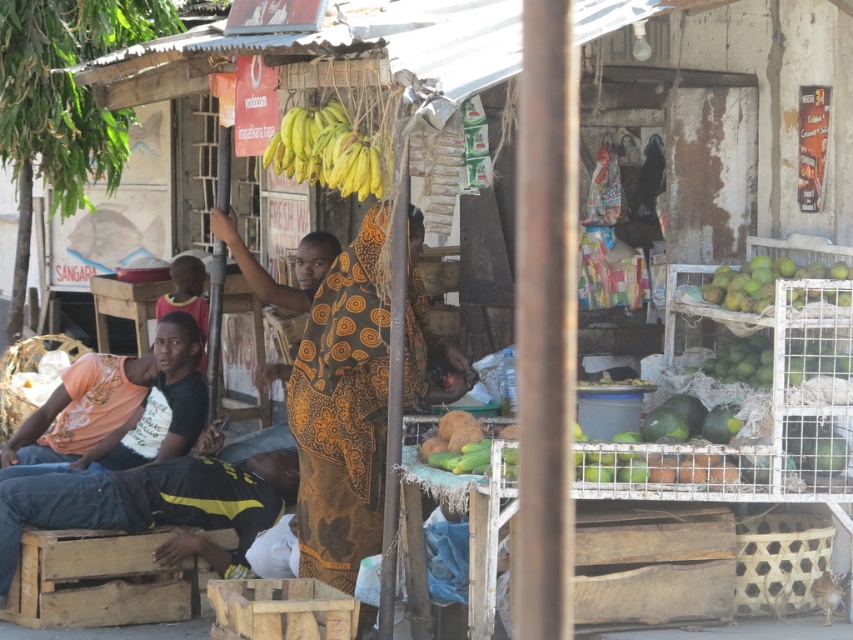
Does wooden crate at lower center have a greater height compared to green matte mangoes at right?

Indeed, wooden crate at lower center has a greater height compared to green matte mangoes at right.

Which is more to the right, wooden crate at lower center or green matte mangoes at right?

green matte mangoes at right is more to the right.

Who is more distant from viewer, (347, 596) or (755, 266)?

The point (755, 266) is behind.

The image size is (853, 640). Find the location of `wooden crate at lower center`. wooden crate at lower center is located at coordinates (280, 609).

Does orange t-shirt at left appear over green matte mangoes at right?

No.

Image resolution: width=853 pixels, height=640 pixels. What are the coordinates of `orange t-shirt at left` in the screenshot? It's located at (120, 403).

This screenshot has height=640, width=853. I want to click on orange t-shirt at left, so click(x=120, y=403).

Based on the photo, between black cotton shirt at lower left and orange t-shirt at left, which one appears on the left side from the viewer's perspective?

Positioned to the left is orange t-shirt at left.

What do you see at coordinates (154, 506) in the screenshot? I see `black cotton shirt at lower left` at bounding box center [154, 506].

In order to click on black cotton shirt at lower left in this screenshot , I will do `click(154, 506)`.